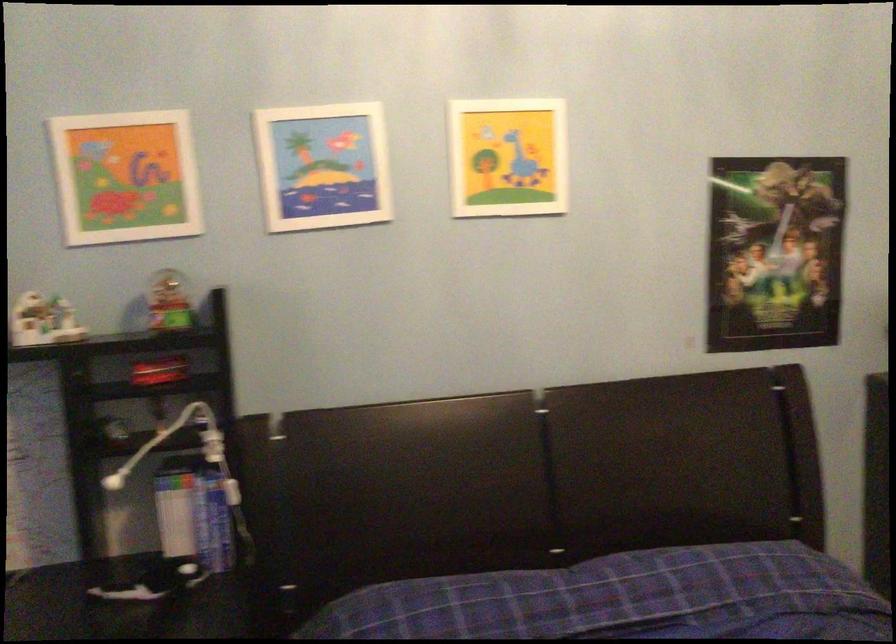
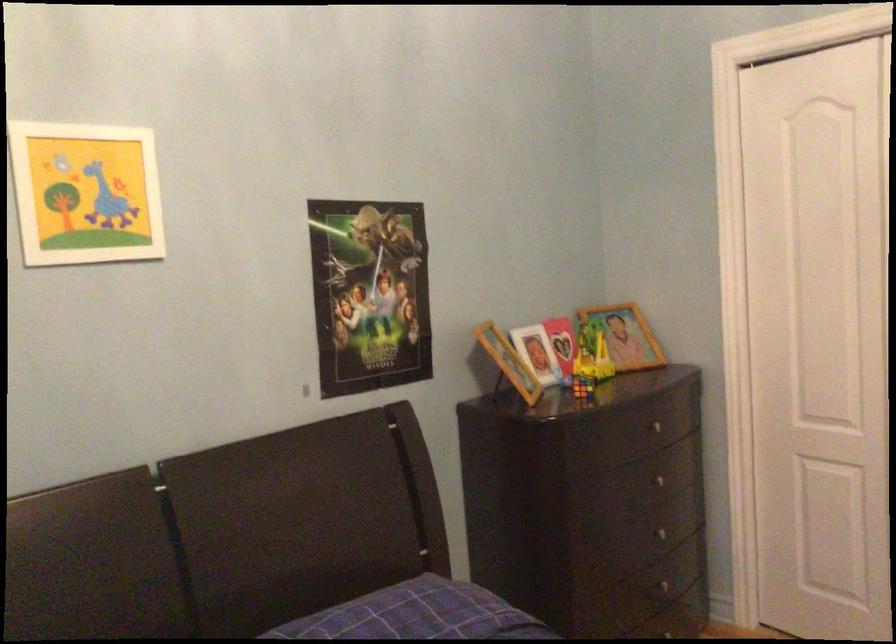
Question: Based on the continuous images, in which direction is the camera rotating? Reply with the corresponding letter.

Choices:
 (A) Left
 (B) Right
 (C) Up
 (D) Down

Answer: (B)